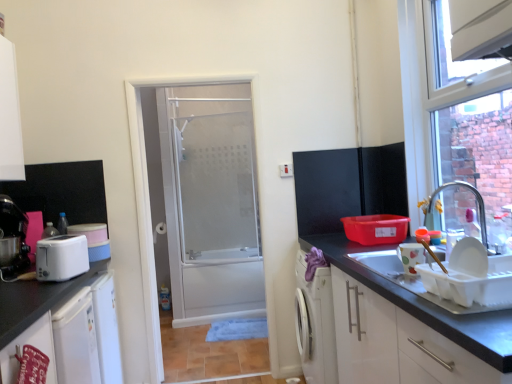
You are a GUI agent. You are given a task and a screenshot of the screen. Output one action in this format:
    pyautogui.click(x=<x>, y=<y>)
    Task: Click on the free space to the left of matte ceramic cup at right, which is counted as the second appliance, starting from the back
    The height and width of the screenshot is (384, 512).
    Given the screenshot: What is the action you would take?
    pyautogui.click(x=380, y=272)